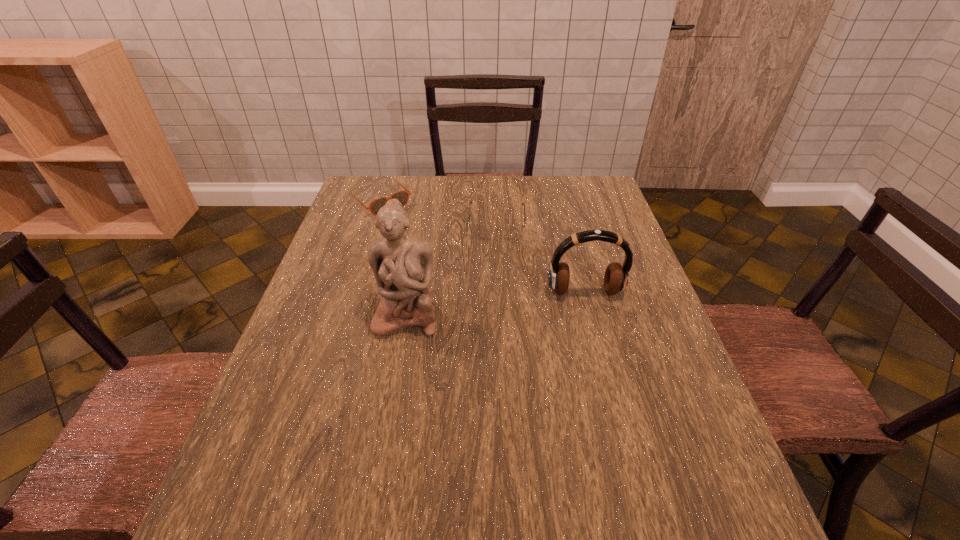
In order to click on the tallest object in this screenshot , I will do `click(402, 266)`.

This screenshot has width=960, height=540. Find the location of `headset`. headset is located at coordinates (616, 275).

Find the location of a particular element. This screenshot has width=960, height=540. the rightmost object is located at coordinates pos(616,275).

Locate an element on the screen. the second object from right to left is located at coordinates (482, 231).

I want to click on sunglasses, so click(x=402, y=196).

At what (x,y) coordinates should I click in order to perform the action: click on vacant space located 0.190m on the front-facing side of the tallest object. Please return your answer as a coordinate pair (x, y). The image size is (960, 540). Looking at the image, I should click on (390, 411).

In order to click on vacant space situated on the ear cup of the rightmost object in this screenshot , I will do `click(598, 343)`.

This screenshot has height=540, width=960. I want to click on vacant position located on the front-facing side of the third object from left to right, so click(496, 293).

Locate an element on the screen. Image resolution: width=960 pixels, height=540 pixels. free space located on the front-facing side of the third object from left to right is located at coordinates (496, 344).

You are a GUI agent. You are given a task and a screenshot of the screen. Output one action in this format:
    pyautogui.click(x=<x>, y=<y>)
    Task: Click on the vacant region located 0.350m on the front-facing side of the third object from left to right
    The image size is (960, 540).
    Given the screenshot: What is the action you would take?
    pyautogui.click(x=496, y=328)